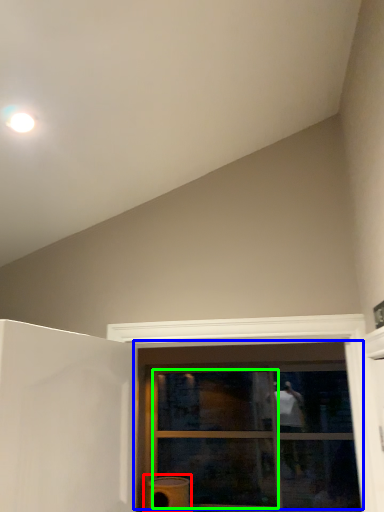
Question: Which is farther away from water heater (highlighted by a red box)? window (highlighted by a blue box) or glass door (highlighted by a green box)?

Choices:
 (A) window
 (B) glass door

Answer: (A)